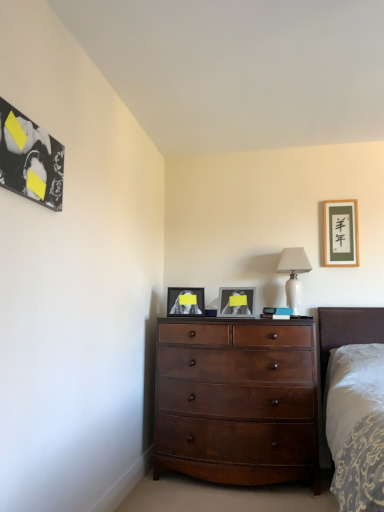
Locate an element on the screen. matte gold picture frame at upper right, the fourth picture frame when ordered from left to right is located at coordinates (341, 233).

At what (x,y) coordinates should I click in order to perform the action: click on white glossy picture frame at center, which ranks as the 2th picture frame in front-to-back order. Please return your answer as a coordinate pair (x, y). This screenshot has height=512, width=384. Looking at the image, I should click on (236, 302).

The image size is (384, 512). What are the coordinates of `black glossy picture frame at upper left, the fourth picture frame in the back-to-front sequence` in the screenshot? It's located at (30, 159).

What do you see at coordinates (30, 159) in the screenshot? I see `black glossy picture frame at upper left, acting as the first picture frame starting from the left` at bounding box center [30, 159].

Identify the location of matte gold picture frame at upper right, the fourth picture frame when ordered from left to right. The height and width of the screenshot is (512, 384). (341, 233).

From a real-world perspective, between white glossy table lamp at upper right and matte gold picture frame at upper right, the fourth picture frame when ordered from left to right, who is vertically lower?

From a 3D spatial view, white glossy table lamp at upper right is below.

Considering the points (299, 297) and (356, 218), which point is behind, point (299, 297) or point (356, 218)?

The point (356, 218) is behind.

Is white glossy table lamp at upper right bigger than matte gold picture frame at upper right, the fourth picture frame when ordered from left to right?

Yes, white glossy table lamp at upper right is bigger than matte gold picture frame at upper right, the fourth picture frame when ordered from left to right.

Could you measure the distance between white glossy table lamp at upper right and matte gold picture frame at upper right, the 1th picture frame when ordered from back to front?

A distance of 13.48 inches exists between white glossy table lamp at upper right and matte gold picture frame at upper right, the 1th picture frame when ordered from back to front.

Is black glossy picture frame at upper left, acting as the first picture frame starting from the left, not close to matte black picture frame at center, arranged as the 2th picture frame when viewed from the back?

Yes, black glossy picture frame at upper left, acting as the first picture frame starting from the left, and matte black picture frame at center, arranged as the 2th picture frame when viewed from the back, are located far from each other.

Is black glossy picture frame at upper left, acting as the 1th picture frame starting from the front, taller or shorter than matte black picture frame at center, arranged as the 2th picture frame when viewed from the back?

black glossy picture frame at upper left, acting as the 1th picture frame starting from the front, is taller than matte black picture frame at center, arranged as the 2th picture frame when viewed from the back.

Is white glossy picture frame at center, acting as the second picture frame starting from the right, in contact with white glossy table lamp at upper right?

No, white glossy picture frame at center, acting as the second picture frame starting from the right, is not beside white glossy table lamp at upper right.

Who is taller, white glossy picture frame at center, which is the third picture frame in left-to-right order, or white glossy table lamp at upper right?

With more height is white glossy table lamp at upper right.

Does white glossy picture frame at center, which ranks as the 2th picture frame in front-to-back order, appear on the left side of white glossy table lamp at upper right?

Correct, you'll find white glossy picture frame at center, which ranks as the 2th picture frame in front-to-back order, to the left of white glossy table lamp at upper right.

From a real-world perspective, relative to white glossy table lamp at upper right, is white glossy picture frame at center, the 3th picture frame positioned from the back, vertically above or below?

From a real-world perspective, white glossy picture frame at center, the 3th picture frame positioned from the back, is physically below white glossy table lamp at upper right.

From the image's perspective, between matte black picture frame at center, arranged as the 2th picture frame when viewed from the back, and black glossy picture frame at upper left, acting as the 1th picture frame starting from the front, who is located below?

matte black picture frame at center, arranged as the 2th picture frame when viewed from the back.

Is the depth of matte black picture frame at center, marked as the 3th picture frame in a right-to-left arrangement, greater than that of black glossy picture frame at upper left, acting as the 1th picture frame starting from the front?

Yes, the depth of matte black picture frame at center, marked as the 3th picture frame in a right-to-left arrangement, is greater than that of black glossy picture frame at upper left, acting as the 1th picture frame starting from the front.

Choose the correct answer: Is matte black picture frame at center, marked as the 3th picture frame in a right-to-left arrangement, inside black glossy picture frame at upper left, positioned as the fourth picture frame in right-to-left order, or outside it?

The correct answer is: outside.

From the picture: Which point is more forward, (172,300) or (1,141)?

Positioned in front is point (1,141).

Is point (328, 231) less distant than point (219, 474)?

That is False.

From the image's perspective, is matte gold picture frame at upper right, the fourth picture frame when ordered from left to right, located above or below mahogany wood dresser at center?

From the image's perspective, matte gold picture frame at upper right, the fourth picture frame when ordered from left to right, appears above mahogany wood dresser at center.

From a real-world perspective, which is physically below, matte gold picture frame at upper right, which appears as the fourth picture frame when viewed from the front, or mahogany wood dresser at center?

mahogany wood dresser at center is physically lower.

Between matte gold picture frame at upper right, the 1th picture frame when ordered from back to front, and mahogany wood dresser at center, which one has larger size?

mahogany wood dresser at center is bigger.

Can you confirm if matte gold picture frame at upper right, the fourth picture frame when ordered from left to right, is shorter than black glossy picture frame at upper left, positioned as the fourth picture frame in right-to-left order?

No, matte gold picture frame at upper right, the fourth picture frame when ordered from left to right, is not shorter than black glossy picture frame at upper left, positioned as the fourth picture frame in right-to-left order.

Considering the positions of points (349, 207) and (3, 160), is point (349, 207) farther from camera compared to point (3, 160)?

Yes, it is behind point (3, 160).

Looking at the image, does matte gold picture frame at upper right, positioned as the first picture frame in right-to-left order, seem bigger or smaller compared to black glossy picture frame at upper left, positioned as the fourth picture frame in right-to-left order?

Considering their sizes, matte gold picture frame at upper right, positioned as the first picture frame in right-to-left order, takes up more space than black glossy picture frame at upper left, positioned as the fourth picture frame in right-to-left order.

From a real-world perspective, is black glossy picture frame at upper left, acting as the first picture frame starting from the left, below matte gold picture frame at upper right, which appears as the fourth picture frame when viewed from the front?

Yes, from a real-world perspective, black glossy picture frame at upper left, acting as the first picture frame starting from the left, is below matte gold picture frame at upper right, which appears as the fourth picture frame when viewed from the front.

Could you tell me if black glossy picture frame at upper left, acting as the first picture frame starting from the left, is turned towards matte gold picture frame at upper right, the 1th picture frame when ordered from back to front?

No, black glossy picture frame at upper left, acting as the first picture frame starting from the left, does not turn towards matte gold picture frame at upper right, the 1th picture frame when ordered from back to front.

Considering the relative sizes of black glossy picture frame at upper left, positioned as the fourth picture frame in right-to-left order, and matte gold picture frame at upper right, the fourth picture frame when ordered from left to right, in the image provided, is black glossy picture frame at upper left, positioned as the fourth picture frame in right-to-left order, bigger than matte gold picture frame at upper right, the fourth picture frame when ordered from left to right,?

Incorrect, black glossy picture frame at upper left, positioned as the fourth picture frame in right-to-left order, is not larger than matte gold picture frame at upper right, the fourth picture frame when ordered from left to right.

Looking at this image, considering the relative sizes of black glossy picture frame at upper left, positioned as the fourth picture frame in right-to-left order, and matte gold picture frame at upper right, the fourth picture frame when ordered from left to right, in the image provided, is black glossy picture frame at upper left, positioned as the fourth picture frame in right-to-left order, thinner than matte gold picture frame at upper right, the fourth picture frame when ordered from left to right,?

Indeed, black glossy picture frame at upper left, positioned as the fourth picture frame in right-to-left order, has a lesser width compared to matte gold picture frame at upper right, the fourth picture frame when ordered from left to right.

This screenshot has height=512, width=384. Identify the location of table lamp below the matte gold picture frame at upper right, positioned as the first picture frame in right-to-left order (from a real-world perspective). pos(293,274).

Locate an element on the screen. The height and width of the screenshot is (512, 384). the 2nd picture frame behind the black glossy picture frame at upper left, acting as the first picture frame starting from the left, counting from the anchor's position is located at coordinates (185, 301).

Considering their positions, is matte black picture frame at center, arranged as the 2th picture frame when viewed from the back, positioned closer to white glossy picture frame at center, the 3th picture frame positioned from the back, than matte gold picture frame at upper right, the 1th picture frame when ordered from back to front?

matte black picture frame at center, arranged as the 2th picture frame when viewed from the back.

Which object lies further to the anchor point matte gold picture frame at upper right, which appears as the fourth picture frame when viewed from the front, white glossy picture frame at center, the 3th picture frame positioned from the back, or white glossy table lamp at upper right?

white glossy picture frame at center, the 3th picture frame positioned from the back, is further to matte gold picture frame at upper right, which appears as the fourth picture frame when viewed from the front.

Estimate the real-world distances between objects in this image. Which object is further from matte gold picture frame at upper right, the fourth picture frame when ordered from left to right, black glossy picture frame at upper left, acting as the 1th picture frame starting from the front, or white glossy picture frame at center, which ranks as the 2th picture frame in front-to-back order?

black glossy picture frame at upper left, acting as the 1th picture frame starting from the front, lies further to matte gold picture frame at upper right, the fourth picture frame when ordered from left to right, than the other object.

Which object lies further to the anchor point mahogany wood dresser at center, matte black picture frame at center, the third picture frame positioned from the front, or white glossy table lamp at upper right?

The object further to mahogany wood dresser at center is white glossy table lamp at upper right.

Which object lies further to the anchor point mahogany wood dresser at center, black glossy picture frame at upper left, acting as the 1th picture frame starting from the front, or white glossy picture frame at center, the 3th picture frame positioned from the back?

black glossy picture frame at upper left, acting as the 1th picture frame starting from the front, lies further to mahogany wood dresser at center than the other object.

Consider the image. When comparing their distances from matte gold picture frame at upper right, which appears as the fourth picture frame when viewed from the front, does matte black picture frame at center, the third picture frame positioned from the front, or mahogany wood dresser at center seem closer?

matte black picture frame at center, the third picture frame positioned from the front, is positioned closer to the anchor matte gold picture frame at upper right, which appears as the fourth picture frame when viewed from the front.

Which object lies nearer to the anchor point matte black picture frame at center, arranged as the 2th picture frame when viewed from the back, matte gold picture frame at upper right, the fourth picture frame when ordered from left to right, or mahogany wood dresser at center?

mahogany wood dresser at center is closer to matte black picture frame at center, arranged as the 2th picture frame when viewed from the back.

Estimate the real-world distances between objects in this image. Which object is further from white glossy picture frame at center, which is the third picture frame in left-to-right order, matte gold picture frame at upper right, the 1th picture frame when ordered from back to front, or mahogany wood dresser at center?

matte gold picture frame at upper right, the 1th picture frame when ordered from back to front, is positioned further to the anchor white glossy picture frame at center, which is the third picture frame in left-to-right order.

You are a GUI agent. You are given a task and a screenshot of the screen. Output one action in this format:
    pyautogui.click(x=<x>, y=<y>)
    Task: Click on the table lamp located between white glossy picture frame at center, which ranks as the 2th picture frame in front-to-back order, and matte gold picture frame at upper right, the 1th picture frame when ordered from back to front, in the left-right direction
    This screenshot has height=512, width=384.
    Given the screenshot: What is the action you would take?
    pyautogui.click(x=293, y=274)

The height and width of the screenshot is (512, 384). Identify the location of table lamp positioned between black glossy picture frame at upper left, positioned as the fourth picture frame in right-to-left order, and matte gold picture frame at upper right, the 1th picture frame when ordered from back to front, from near to far. 293,274.

Locate an element on the screen. picture frame between matte black picture frame at center, which is the second picture frame from left to right, and matte gold picture frame at upper right, the 1th picture frame when ordered from back to front, in the horizontal direction is located at coordinates (236, 302).

Locate an element on the screen. table lamp between black glossy picture frame at upper left, acting as the 1th picture frame starting from the front, and matte black picture frame at center, arranged as the 2th picture frame when viewed from the back, from front to back is located at coordinates (293, 274).